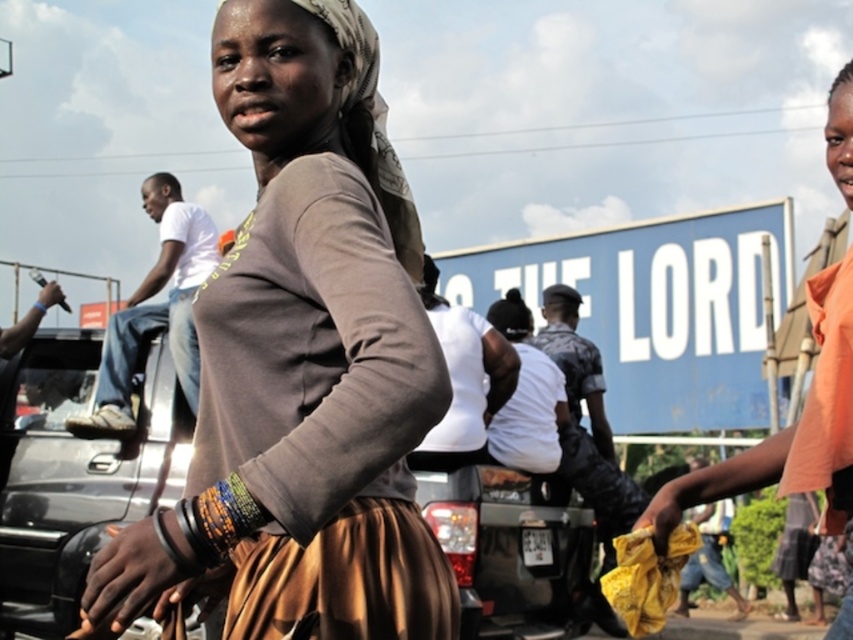
You are a photographer trying to capture a shot of the brown matte shirt at center and the metallic gray car at center. Which object should you focus on first if you want to capture both in a single frame without moving the camera?

The brown matte shirt at center is above the metallic gray car at center, so you should focus on the metallic gray car at center first to ensure both are in frame.

Where is the white matte shirt at center located in the image?

The white matte shirt at center is located at point 0.597 in the x coordinate and 0.545 in the y coordinate.

Looking at the scene, where is the white matte shirt at center in relation to the yellow fabric bag at lower right?

The white matte shirt at center is located above the yellow fabric bag at lower right.